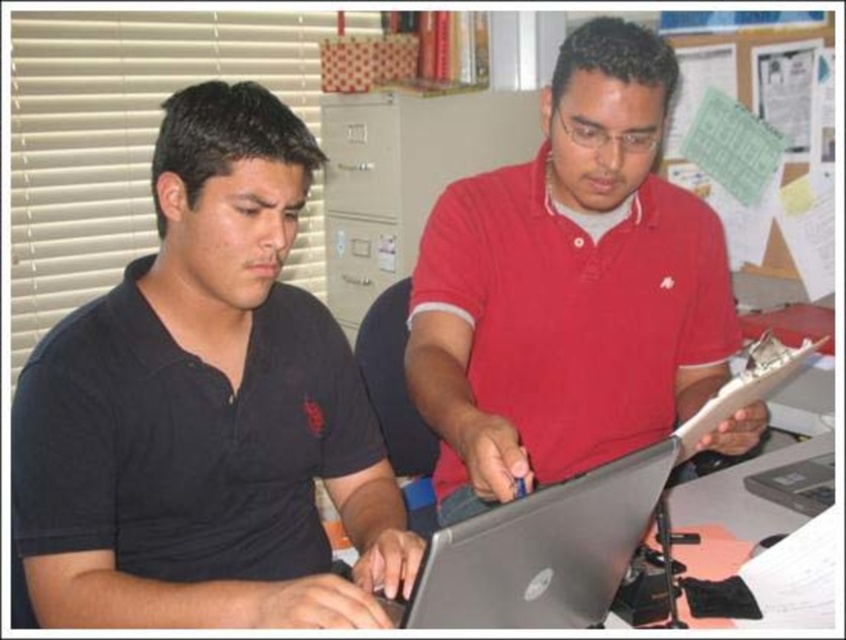
How far apart are matte red shirt at center and silver metallic laptop at center?

12.63 inches

Does matte red shirt at center appear under silver metallic laptop at center?

Actually, matte red shirt at center is above silver metallic laptop at center.

Based on the photo, who is more distant from viewer, (613,193) or (561,532)?

The point (613,193) is behind.

You are a GUI agent. You are given a task and a screenshot of the screen. Output one action in this format:
    pyautogui.click(x=<x>, y=<y>)
    Task: Click on the matte red shirt at center
    This screenshot has width=846, height=640.
    Given the screenshot: What is the action you would take?
    pyautogui.click(x=569, y=288)

Does point (514, 481) lie behind point (393, 132)?

That is False.

Is matte red shirt at center below matte gray file cabinet at center?

Yes.

The image size is (846, 640). Find the location of `matte red shirt at center`. matte red shirt at center is located at coordinates (569, 288).

Can you confirm if black matte shirt at left is bigger than matte red shirt at center?

No, black matte shirt at left is not bigger than matte red shirt at center.

Is black matte shirt at left to the right of matte red shirt at center from the viewer's perspective?

No, black matte shirt at left is not to the right of matte red shirt at center.

Between point (149, 552) and point (581, 300), which one is positioned behind?

The point (581, 300) is behind.

At what (x,y) coordinates should I click in order to perform the action: click on black matte shirt at left. Please return your answer as a coordinate pair (x, y). The image size is (846, 640). Looking at the image, I should click on (205, 410).